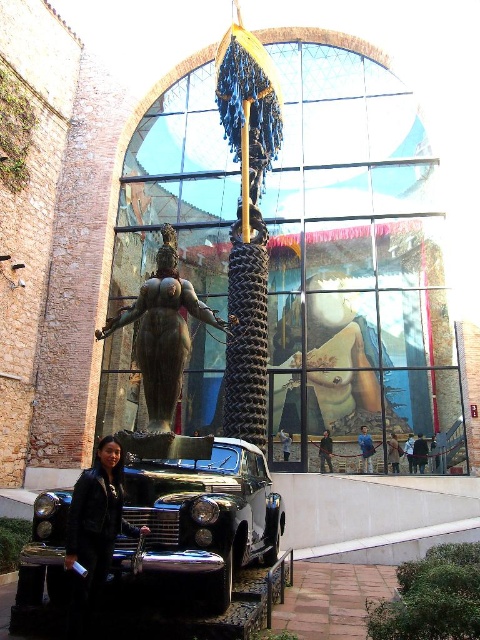
Question: Which object is the closest to the bronze statue at center?

Choices:
 (A) shiny chrome car at center
 (B) black leather jacket at lower left

Answer: (A)

Question: Does shiny chrome car at center appear under black leather jacket at lower left?

Choices:
 (A) no
 (B) yes

Answer: (B)

Question: Among these objects, which one is nearest to the camera?

Choices:
 (A) bronze statue at center
 (B) black leather jacket at lower left
 (C) shiny chrome car at center

Answer: (B)

Question: Is shiny chrome car at center positioned behind bronze statue at center?

Choices:
 (A) yes
 (B) no

Answer: (B)

Question: Is shiny chrome car at center below bronze statue at center?

Choices:
 (A) yes
 (B) no

Answer: (A)

Question: Which point is farther to the camera?

Choices:
 (A) (58, 529)
 (B) (107, 552)

Answer: (A)